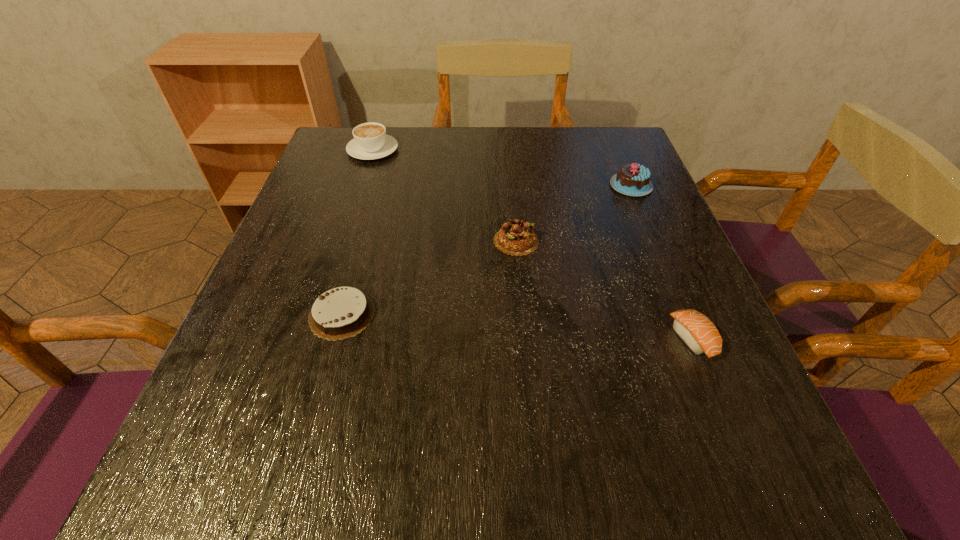
In the image, there is a desktop. At what (x,y) coordinates should I click in order to perform the action: click on vacant space at the far edge. Please return your answer as a coordinate pair (x, y). The image size is (960, 540). Looking at the image, I should click on (413, 147).

Locate an element on the screen. vacant space at the near edge of the desktop is located at coordinates (469, 482).

In the image, there is a desktop. Find the location of `vacant space at the left edge`. vacant space at the left edge is located at coordinates (292, 273).

In the image, there is a desktop. Where is `vacant space at the right edge`? The image size is (960, 540). vacant space at the right edge is located at coordinates (653, 202).

You are a GUI agent. You are given a task and a screenshot of the screen. Output one action in this format:
    pyautogui.click(x=<x>, y=<y>)
    Task: Click on the blank space at the far left corner of the desktop
    
    Given the screenshot: What is the action you would take?
    pyautogui.click(x=335, y=130)

This screenshot has width=960, height=540. What are the coordinates of `vacant space at the far right corner` in the screenshot? It's located at (593, 153).

The height and width of the screenshot is (540, 960). I want to click on unoccupied area between the rightmost chocolate cake and the third object from left to right, so click(573, 213).

Where is `vacant region between the nearest chocolate cake and the third object from left to right`? This screenshot has width=960, height=540. vacant region between the nearest chocolate cake and the third object from left to right is located at coordinates (429, 278).

Identify the location of free space between the sushi and the shortest object. (517, 327).

Locate an element on the screen. This screenshot has height=540, width=960. free space between the farthest chocolate cake and the nearest chocolate cake is located at coordinates (487, 250).